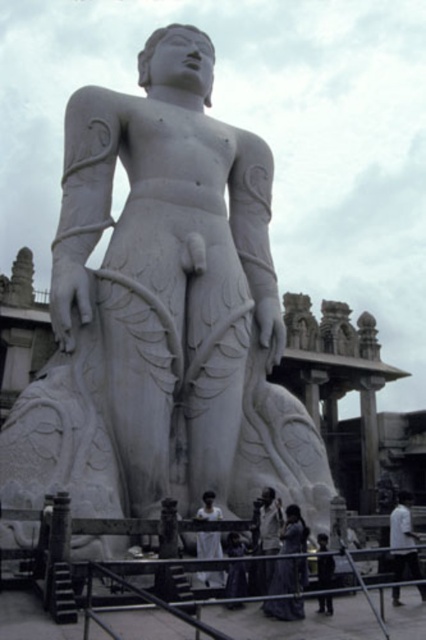
Is white marble statue at center thinner than silky purple dress at center?

Incorrect, white marble statue at center's width is not less than silky purple dress at center's.

Can you confirm if white marble statue at center is bigger than silky purple dress at center?

Yes, white marble statue at center is bigger than silky purple dress at center.

Is point (78, 198) more distant than point (285, 544)?

Yes, point (78, 198) is farther from viewer.

You are a GUI agent. You are given a task and a screenshot of the screen. Output one action in this format:
    pyautogui.click(x=<x>, y=<y>)
    Task: Click on the white marble statue at center
    This screenshot has width=426, height=640.
    Given the screenshot: What is the action you would take?
    pyautogui.click(x=163, y=314)

From the picture: Measure the distance from white fabric dress at center to dark gray fabric at center.

white fabric dress at center is 11.97 feet away from dark gray fabric at center.

Is point (268, 547) positioned in front of point (244, 579)?

No, (268, 547) is behind (244, 579).

Describe the element at coordinates (268, 520) in the screenshot. I see `white fabric dress at center` at that location.

You are a GUI agent. You are given a task and a screenshot of the screen. Output one action in this format:
    pyautogui.click(x=<x>, y=<y>)
    Task: Click on the white fabric dress at center
    
    Given the screenshot: What is the action you would take?
    pyautogui.click(x=268, y=520)

In the scene shown: Who is taller, white marble statue at center or dark gray fabric at lower center?

With more height is white marble statue at center.

Which is behind, point (166, 161) or point (322, 573)?

Point (166, 161)

The height and width of the screenshot is (640, 426). I want to click on white marble statue at center, so click(x=163, y=314).